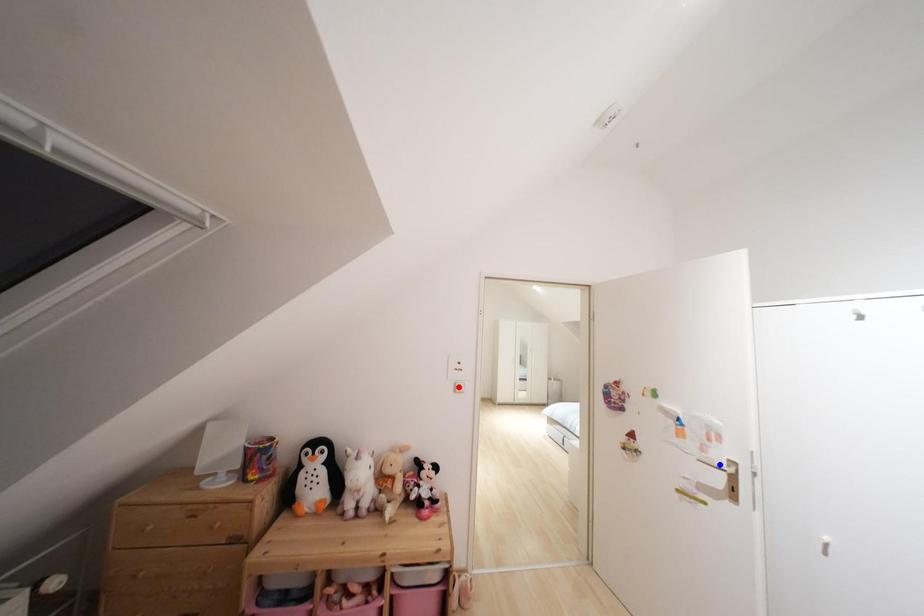
Question: Which of the two points in the image is closer to the camera?

Choices:
 (A) Blue point is closer.
 (B) Red point is closer.

Answer: (A)